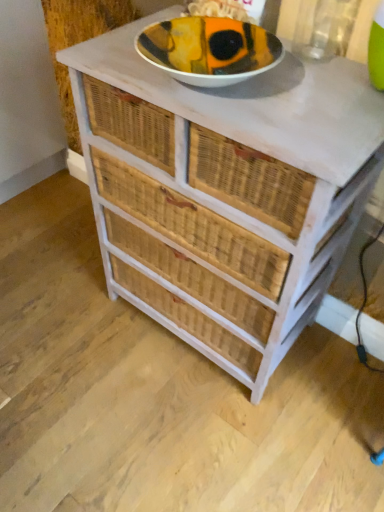
This screenshot has height=512, width=384. I want to click on vacant point to the left of white wicker chest of drawers at center, so [63, 315].